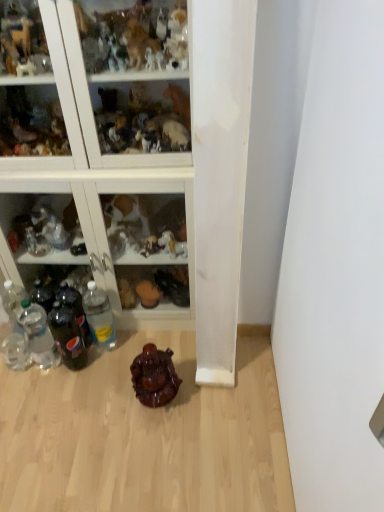
Where is `free space between clear plastic bottles at left, the 1th bottle from the left, and shiny brown statue at center`? The width and height of the screenshot is (384, 512). free space between clear plastic bottles at left, the 1th bottle from the left, and shiny brown statue at center is located at coordinates (92, 382).